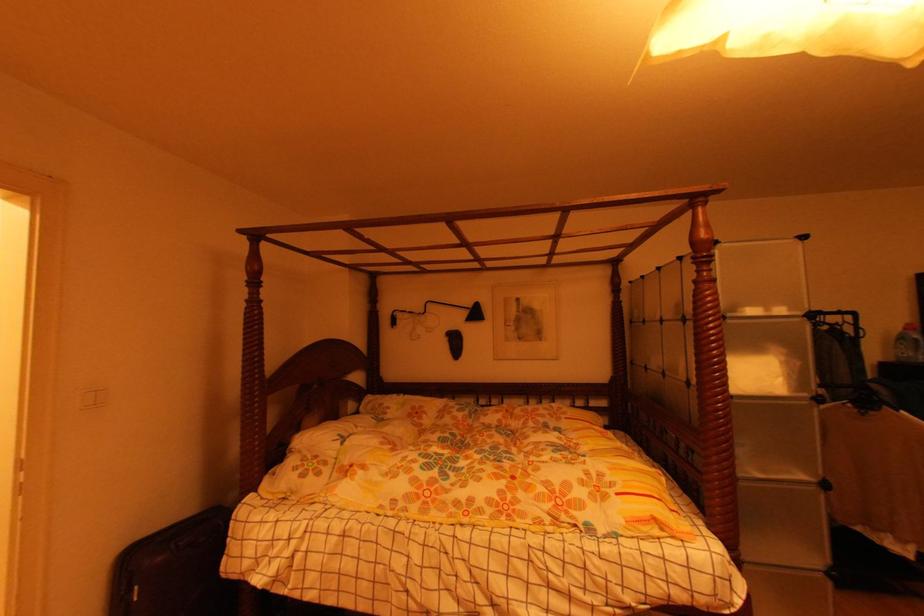
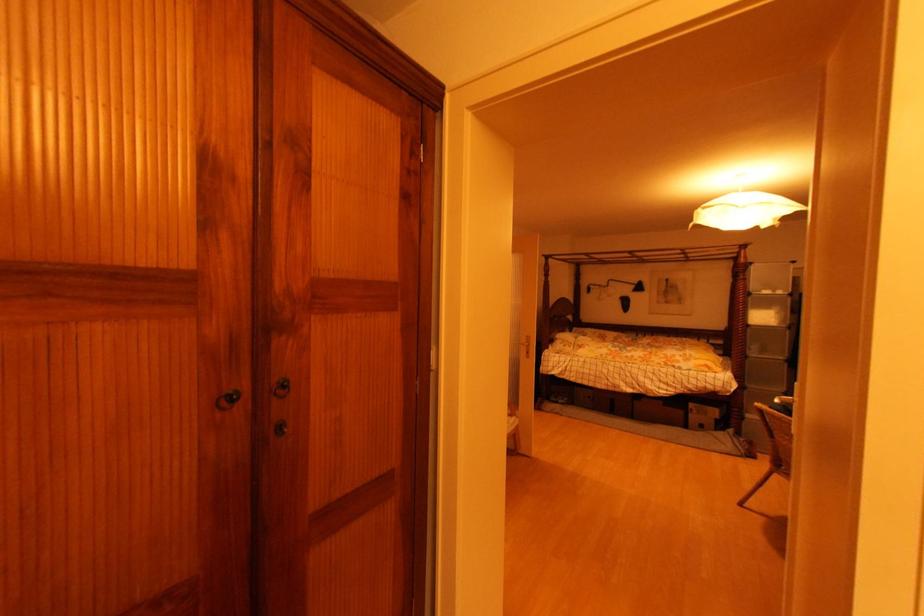
Question: The images are taken continuously from a first-person perspective. In which direction are you moving?

Choices:
 (A) Left
 (B) Right
 (C) Forward
 (D) Backward

Answer: (D)